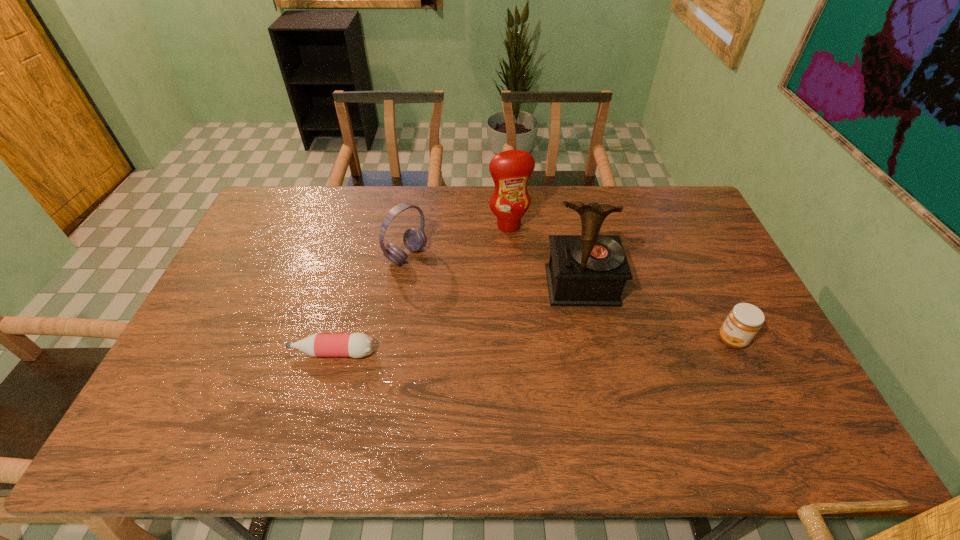
Where is `bottle`? Image resolution: width=960 pixels, height=540 pixels. bottle is located at coordinates (356, 345).

At what (x,y) coordinates should I click in order to perform the action: click on jam. Please return your answer as a coordinate pair (x, y). The width and height of the screenshot is (960, 540). Looking at the image, I should click on (743, 322).

This screenshot has height=540, width=960. In order to click on the second shortest object in this screenshot , I will do `click(743, 322)`.

You are a GUI agent. You are given a task and a screenshot of the screen. Output one action in this format:
    pyautogui.click(x=<x>, y=<y>)
    Task: Click on the second tallest object
    
    Given the screenshot: What is the action you would take?
    pyautogui.click(x=510, y=170)

Where is `the third object from left to right`? This screenshot has width=960, height=540. the third object from left to right is located at coordinates 510,170.

What are the coordinates of `headset` in the screenshot? It's located at (414, 239).

Find the location of a particular element. The width and height of the screenshot is (960, 540). the tallest object is located at coordinates (591, 270).

Identify the location of phonograph_record. (591, 270).

The height and width of the screenshot is (540, 960). Identify the location of free spot located 0.130m with the cap open on the shortest object. (241, 353).

Locate an element on the screen. This screenshot has width=960, height=540. free space located 0.250m with the cap open on the shortest object is located at coordinates (196, 353).